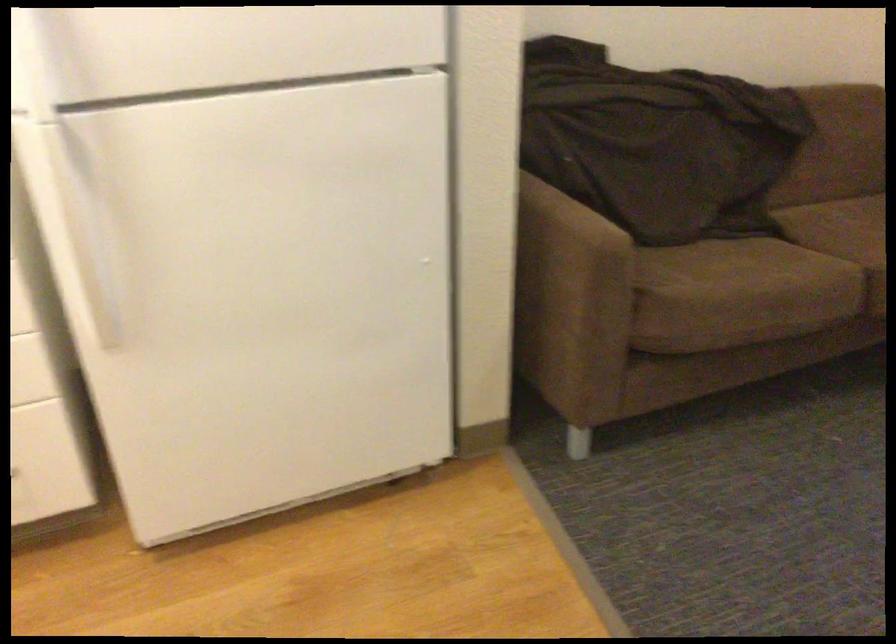
Based on the continuous images, in which direction is the camera rotating?

The rotation direction of the camera is left-down.